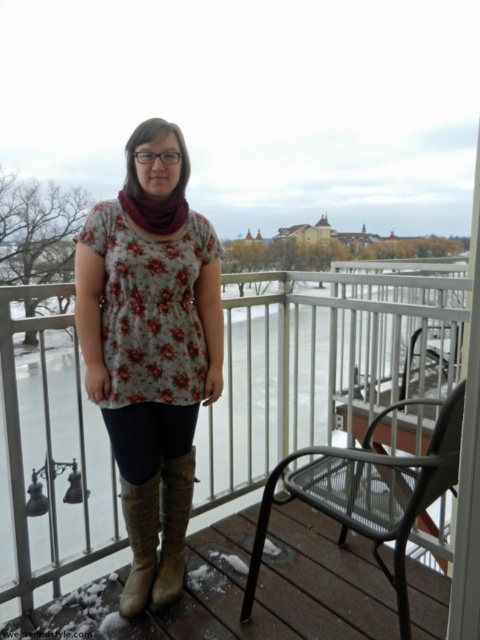
Is point (312, 586) farther from viewer compared to point (254, 570)?

Yes.

This screenshot has width=480, height=640. Find the location of `brown leather boots at lower center`. brown leather boots at lower center is located at coordinates (242, 588).

Measure the distance between point (251, 634) and camera.

Point (251, 634) and camera are 1.90 meters apart from each other.

I want to click on brown leather boots at lower center, so click(242, 588).

Between point (186, 458) and point (137, 522), which one is positioned behind?

Point (186, 458)

Does leather/matte boot at lower center have a greater width compared to leather boots at center?

Correct, the width of leather/matte boot at lower center exceeds that of leather boots at center.

Between point (180, 518) and point (139, 490), which one is positioned behind?

Positioned behind is point (180, 518).

The width and height of the screenshot is (480, 640). What are the coordinates of `leather/matte boot at lower center` in the screenshot? It's located at (172, 525).

Between floral fabric top at center and brown leather boots at lower center, which one is positioned higher?

floral fabric top at center

You are a GUI agent. You are given a task and a screenshot of the screen. Output one action in this format:
    pyautogui.click(x=<x>, y=<y>)
    Task: Click on the floral fabric top at center
    The height and width of the screenshot is (640, 480).
    Given the screenshot: What is the action you would take?
    pyautogui.click(x=149, y=374)

Is point (109, 401) positioned before point (268, 625)?

That is False.

I want to click on floral fabric top at center, so click(x=149, y=374).